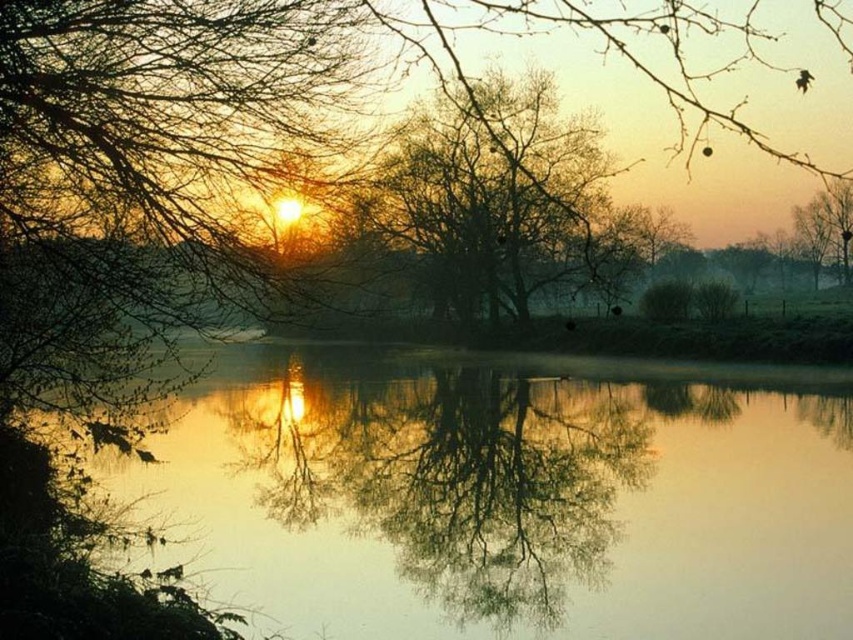
Question: Which of the following is the closest to the observer?

Choices:
 (A) bare branches at center
 (B) silvery reflective water at center

Answer: (A)

Question: Can you confirm if silvery reflective water at center is smaller than bare branches at center?

Choices:
 (A) no
 (B) yes

Answer: (B)

Question: Is silvery reflective water at center positioned behind bare branches at center?

Choices:
 (A) no
 (B) yes

Answer: (B)

Question: Can you confirm if silvery reflective water at center is bigger than bare branches at center?

Choices:
 (A) yes
 (B) no

Answer: (B)

Question: Which point is farther to the camera?

Choices:
 (A) bare branches at center
 (B) silvery reflective water at center

Answer: (B)

Question: Which of the following is the closest to the observer?

Choices:
 (A) bare branches at center
 (B) silvery reflective water at center

Answer: (A)